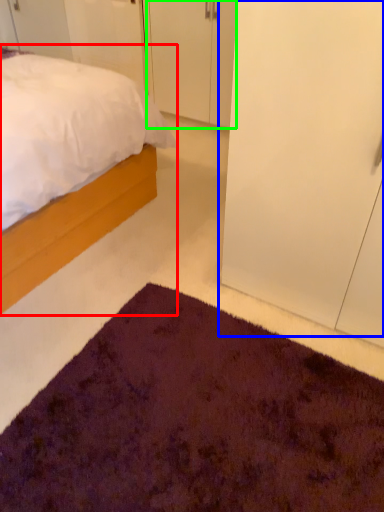
Question: Which object is the closest to the bed (highlighted by a red box)? Choose among these: glass door (highlighted by a blue box) or door (highlighted by a green box).

Choices:
 (A) glass door
 (B) door

Answer: (A)